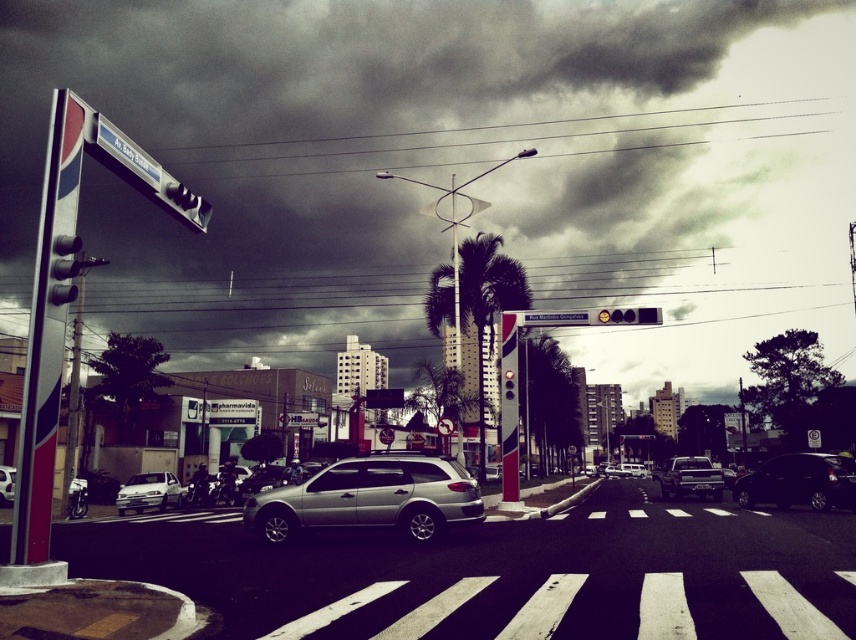
Question: In this image, where is silver metallic sedan at lower left located relative to metallic rectangular traffic light at center?

Choices:
 (A) right
 (B) left

Answer: (B)

Question: Considering the real-world distances, which object is farthest from the silver metallic suv at center?

Choices:
 (A) black matte car at center-right
 (B) silver metallic sedan at lower left

Answer: (A)

Question: Does satin silver car at center appear under metallic rectangular traffic light at center?

Choices:
 (A) yes
 (B) no

Answer: (A)

Question: Which point appears farthest from the camera in this image?

Choices:
 (A) (253, 516)
 (B) (504, 397)

Answer: (B)

Question: Among these objects, which one is farthest from the camera?

Choices:
 (A) black matte car at center-right
 (B) silver metallic suv at center

Answer: (B)

Question: Can you confirm if metallic rectangular traffic light at center is wider than silver metallic suv at center?

Choices:
 (A) no
 (B) yes

Answer: (B)